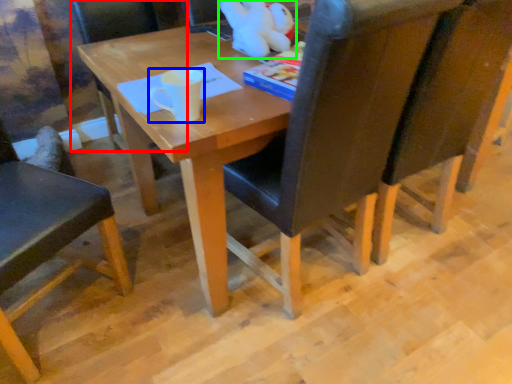
Question: Estimate the real-world distances between objects in this image. Which object is farther from chair (highlighted by a red box), coffee cup (highlighted by a blue box) or toy (highlighted by a green box)?

Choices:
 (A) coffee cup
 (B) toy

Answer: (A)